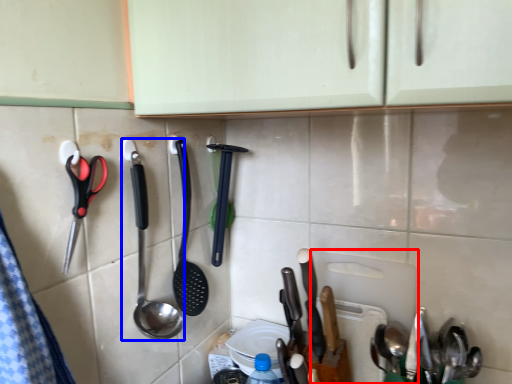
Question: Among these objects, which one is nearest to the camera, cutting board (highlighted by a red box) or spoon (highlighted by a blue box)?

Choices:
 (A) cutting board
 (B) spoon

Answer: (B)